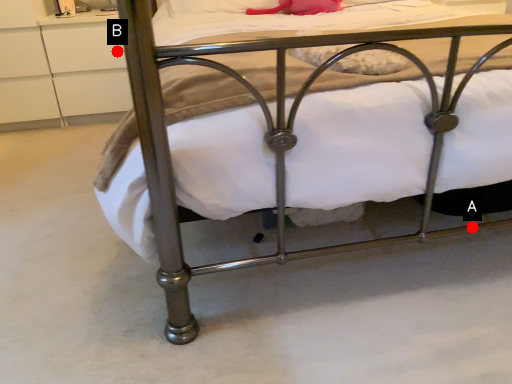
Question: Two points are circled on the image, labeled by A and B beside each circle. Which of the following is the closest to the observer?

Choices:
 (A) A is closer
 (B) B is closer

Answer: (A)